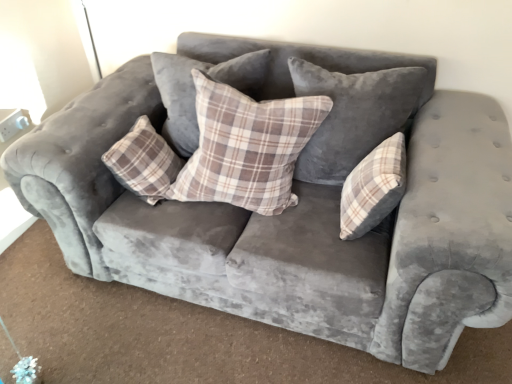
In order to face plaid fabric pillow at center, which is the fourth pillow in left-to-right order, should I rotate leftwards or rightwards?

A 15.595 degree turn to the right will do.

Image resolution: width=512 pixels, height=384 pixels. What do you see at coordinates (195, 90) in the screenshot?
I see `plaid fabric pillow at center, arranged as the first pillow when viewed from the left` at bounding box center [195, 90].

Locate an element on the screen. This screenshot has width=512, height=384. plaid fabric pillow at center, which is counted as the 2th pillow, starting from the left is located at coordinates (246, 147).

In order to click on the 3rd pillow to the right when counting from the plaid fabric pillow at center, arranged as the first pillow when viewed from the left in this screenshot , I will do `click(373, 188)`.

Is plaid fabric pillow at center, which is the fourth pillow in right-to-left order, spatially inside plaid fabric pillow at center, placed as the first pillow when sorted from right to left, or outside of it?

plaid fabric pillow at center, which is the fourth pillow in right-to-left order, is located beyond the bounds of plaid fabric pillow at center, placed as the first pillow when sorted from right to left.

Considering the positions of objects plaid fabric pillow at center, which is the fourth pillow in right-to-left order, and plaid fabric pillow at center, placed as the first pillow when sorted from right to left, in the image provided, who is in front, plaid fabric pillow at center, which is the fourth pillow in right-to-left order, or plaid fabric pillow at center, placed as the first pillow when sorted from right to left,?

plaid fabric pillow at center, placed as the first pillow when sorted from right to left, is more forward.

Between plaid fabric pillow at center, which is the fourth pillow in right-to-left order, and plaid fabric pillow at center, placed as the first pillow when sorted from right to left, which one appears on the right side from the viewer's perspective?

From the viewer's perspective, plaid fabric pillow at center, placed as the first pillow when sorted from right to left, appears more on the right side.

Is velvet plaid pillow at center, which ranks as the second pillow in right-to-left order, to the left or to the right of plaid fabric pillow at center, which is counted as the 2th pillow, starting from the left, in the image?

From the image, it's evident that velvet plaid pillow at center, which ranks as the second pillow in right-to-left order, is to the right of plaid fabric pillow at center, which is counted as the 2th pillow, starting from the left.

Looking at their sizes, would you say velvet plaid pillow at center, which ranks as the second pillow in right-to-left order, is wider or thinner than plaid fabric pillow at center, which is counted as the 2th pillow, starting from the left?

velvet plaid pillow at center, which ranks as the second pillow in right-to-left order, is wider than plaid fabric pillow at center, which is counted as the 2th pillow, starting from the left.

Is point (345, 153) less distant than point (234, 114)?

No, (345, 153) is further to viewer.

I want to click on pillow above the plaid fabric pillow at center, which is the 3th pillow from right to left (from a real-world perspective), so click(x=352, y=115).

Considering the sizes of objects plaid fabric pillow at center, which is the fourth pillow in right-to-left order, and velvet plaid pillow at center, which ranks as the second pillow in right-to-left order, in the image provided, who is bigger, plaid fabric pillow at center, which is the fourth pillow in right-to-left order, or velvet plaid pillow at center, which ranks as the second pillow in right-to-left order,?

velvet plaid pillow at center, which ranks as the second pillow in right-to-left order.

You are a GUI agent. You are given a task and a screenshot of the screen. Output one action in this format:
    pyautogui.click(x=<x>, y=<y>)
    Task: Click on the 2nd pillow to the left of the velvet plaid pillow at center, the third pillow when ordered from left to right, starting your count from the anchor
    
    Given the screenshot: What is the action you would take?
    coord(195,90)

Considering the positions of objects plaid fabric pillow at center, arranged as the first pillow when viewed from the left, and velvet plaid pillow at center, which ranks as the second pillow in right-to-left order, in the image provided, who is in front, plaid fabric pillow at center, arranged as the first pillow when viewed from the left, or velvet plaid pillow at center, which ranks as the second pillow in right-to-left order,?

Positioned in front is velvet plaid pillow at center, which ranks as the second pillow in right-to-left order.

Is point (164, 93) positioned after point (300, 87)?

Yes, it is.

Which object is further away from the camera taking this photo, plaid fabric pillow at center, arranged as the first pillow when viewed from the left, or plaid fabric pillow at center, which is the 3th pillow from right to left?

plaid fabric pillow at center, arranged as the first pillow when viewed from the left, is further from the camera.

From the image's perspective, is plaid fabric pillow at center, which is the fourth pillow in right-to-left order, beneath plaid fabric pillow at center, which is the 3th pillow from right to left?

No, from the image's perspective, plaid fabric pillow at center, which is the fourth pillow in right-to-left order, is not below plaid fabric pillow at center, which is the 3th pillow from right to left.

Would you consider plaid fabric pillow at center, which is the fourth pillow in right-to-left order, to be distant from plaid fabric pillow at center, which is the 3th pillow from right to left?

They are positioned close to each other.

Can you confirm if plaid fabric pillow at center, which is counted as the 2th pillow, starting from the left, is bigger than plaid fabric pillow at center, which is the fourth pillow in left-to-right order?

Correct, plaid fabric pillow at center, which is counted as the 2th pillow, starting from the left, is larger in size than plaid fabric pillow at center, which is the fourth pillow in left-to-right order.

Is plaid fabric pillow at center, which is counted as the 2th pillow, starting from the left, with plaid fabric pillow at center, which is the fourth pillow in left-to-right order?

plaid fabric pillow at center, which is counted as the 2th pillow, starting from the left, and plaid fabric pillow at center, which is the fourth pillow in left-to-right order, are clearly separated.

Who is more distant, plaid fabric pillow at center, which is counted as the 2th pillow, starting from the left, or plaid fabric pillow at center, which is the fourth pillow in left-to-right order?

plaid fabric pillow at center, which is the fourth pillow in left-to-right order, is further away from the camera.

Is plaid fabric pillow at center, which is the 3th pillow from right to left, wider or thinner than plaid fabric pillow at center, arranged as the first pillow when viewed from the left?

plaid fabric pillow at center, which is the 3th pillow from right to left, is wider than plaid fabric pillow at center, arranged as the first pillow when viewed from the left.

This screenshot has height=384, width=512. I want to click on pillow that is the 2nd object located above the plaid fabric pillow at center, which is the 3th pillow from right to left (from the image's perspective), so click(x=195, y=90).

Is plaid fabric pillow at center, which is the 3th pillow from right to left, next to plaid fabric pillow at center, arranged as the first pillow when viewed from the left, and touching it?

No, plaid fabric pillow at center, which is the 3th pillow from right to left, is not touching plaid fabric pillow at center, arranged as the first pillow when viewed from the left.

Is velvet plaid pillow at center, which ranks as the second pillow in right-to-left order, to the left of plaid fabric pillow at center, placed as the first pillow when sorted from right to left, from the viewer's perspective?

Yes.

From a real-world perspective, who is located higher, velvet plaid pillow at center, which ranks as the second pillow in right-to-left order, or plaid fabric pillow at center, which is the fourth pillow in left-to-right order?

velvet plaid pillow at center, which ranks as the second pillow in right-to-left order, is physically above.

From the image's perspective, is velvet plaid pillow at center, the third pillow when ordered from left to right, above or below plaid fabric pillow at center, placed as the first pillow when sorted from right to left?

Based on their image positions, velvet plaid pillow at center, the third pillow when ordered from left to right, is located above plaid fabric pillow at center, placed as the first pillow when sorted from right to left.

Which object is wider, velvet plaid pillow at center, which ranks as the second pillow in right-to-left order, or plaid fabric pillow at center, which is the fourth pillow in left-to-right order?

velvet plaid pillow at center, which ranks as the second pillow in right-to-left order, is wider.

There is a plaid fabric pillow at center, which is the fourth pillow in left-to-right order. At what (x,y) coordinates should I click in order to perform the action: click on the 3rd pillow above it (from the image's perspective). Please return your answer as a coordinate pair (x, y). Looking at the image, I should click on (195, 90).

I want to click on the 1st pillow counting from the left side of the velvet plaid pillow at center, the third pillow when ordered from left to right, so tap(246, 147).

Which object lies nearer to the anchor point plaid fabric pillow at center, which is the fourth pillow in left-to-right order, plaid fabric pillow at center, which is the 3th pillow from right to left, or velvet plaid pillow at center, which ranks as the second pillow in right-to-left order?

velvet plaid pillow at center, which ranks as the second pillow in right-to-left order, is closer to plaid fabric pillow at center, which is the fourth pillow in left-to-right order.

Based on their spatial positions, is plaid fabric pillow at center, which is the 3th pillow from right to left, or plaid fabric pillow at center, placed as the first pillow when sorted from right to left, closer to plaid fabric pillow at center, arranged as the first pillow when viewed from the left?

plaid fabric pillow at center, which is the 3th pillow from right to left, lies closer to plaid fabric pillow at center, arranged as the first pillow when viewed from the left, than the other object.

From the image, which object appears to be nearer to plaid fabric pillow at center, which is counted as the 2th pillow, starting from the left, plaid fabric pillow at center, placed as the first pillow when sorted from right to left, or velvet plaid pillow at center, the third pillow when ordered from left to right?

velvet plaid pillow at center, the third pillow when ordered from left to right, lies closer to plaid fabric pillow at center, which is counted as the 2th pillow, starting from the left, than the other object.

Looking at the image, which one is located closer to plaid fabric pillow at center, which is the fourth pillow in left-to-right order, plaid fabric pillow at center, which is the fourth pillow in right-to-left order, or velvet plaid pillow at center, which ranks as the second pillow in right-to-left order?

velvet plaid pillow at center, which ranks as the second pillow in right-to-left order, is closer to plaid fabric pillow at center, which is the fourth pillow in left-to-right order.

Based on their spatial positions, is plaid fabric pillow at center, arranged as the first pillow when viewed from the left, or velvet plaid pillow at center, which ranks as the second pillow in right-to-left order, closer to plaid fabric pillow at center, which is counted as the 2th pillow, starting from the left?

Based on the image, velvet plaid pillow at center, which ranks as the second pillow in right-to-left order, appears to be nearer to plaid fabric pillow at center, which is counted as the 2th pillow, starting from the left.

Which object lies nearer to the anchor point velvet plaid pillow at center, which ranks as the second pillow in right-to-left order, plaid fabric pillow at center, placed as the first pillow when sorted from right to left, or plaid fabric pillow at center, arranged as the first pillow when viewed from the left?

plaid fabric pillow at center, placed as the first pillow when sorted from right to left, is closer to velvet plaid pillow at center, which ranks as the second pillow in right-to-left order.

Which object lies nearer to the anchor point plaid fabric pillow at center, which is the 3th pillow from right to left, plaid fabric pillow at center, which is the fourth pillow in right-to-left order, or plaid fabric pillow at center, placed as the first pillow when sorted from right to left?

Among the two, plaid fabric pillow at center, which is the fourth pillow in right-to-left order, is located nearer to plaid fabric pillow at center, which is the 3th pillow from right to left.

Looking at the image, which one is located closer to plaid fabric pillow at center, which is the fourth pillow in right-to-left order, velvet plaid pillow at center, which ranks as the second pillow in right-to-left order, or plaid fabric pillow at center, which is the fourth pillow in left-to-right order?

Based on the image, velvet plaid pillow at center, which ranks as the second pillow in right-to-left order, appears to be nearer to plaid fabric pillow at center, which is the fourth pillow in right-to-left order.

Identify the location of pillow between plaid fabric pillow at center, which is the 3th pillow from right to left, and plaid fabric pillow at center, which is the fourth pillow in left-to-right order, from left to right. This screenshot has height=384, width=512. (352, 115).

I want to click on pillow between plaid fabric pillow at center, arranged as the first pillow when viewed from the left, and velvet plaid pillow at center, which ranks as the second pillow in right-to-left order, so click(x=246, y=147).